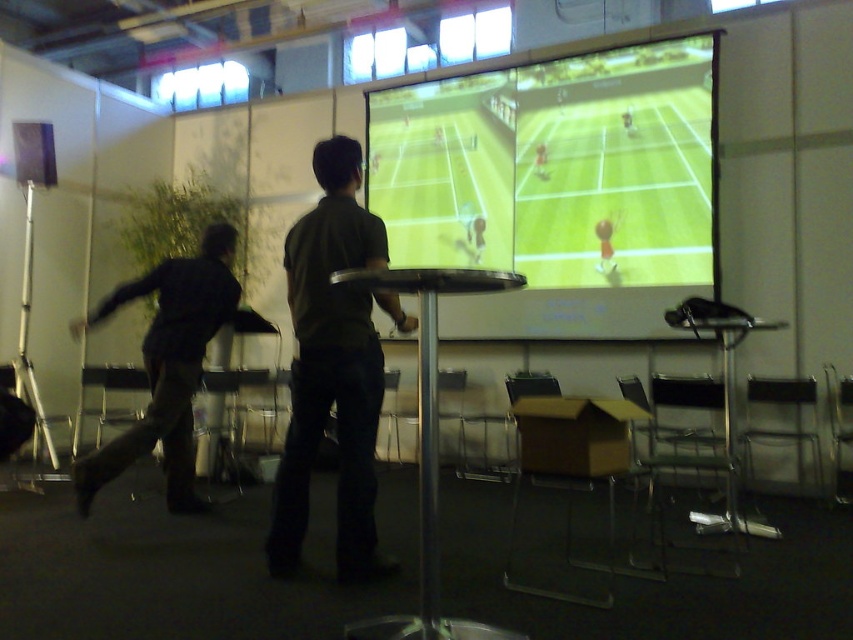
You are a game developer analyzing the scene. The game requires players to hit the ball on the green matte tennis court at center before it lands on the black matte pants at left. Based on their positions, is the ball likely to land on the court or the pants first?

The green matte tennis court at center is located above the black matte pants at left, so the ball will land on the black matte pants at left first.

You are a fitness trainer who wants to ensure proper spacing between two clients playing virtual tennis. The recommended minimum distance between them is 1.2 meters for safety. Are the clients wearing dark green shirt at center and black matte pants at left positioned safely according to the guidelines?

The distance between dark green shirt at center and black matte pants at left is 1.30 meters, which exceeds the recommended minimum of 1.2 meters. Therefore, they are positioned safely according to the guidelines.

You are standing in the room and want to know the exact position of the dark green shirt at center. Can you tell me where it is located in the room?

The dark green shirt at center is located at the 2D coordinates point (334,368) in the room.